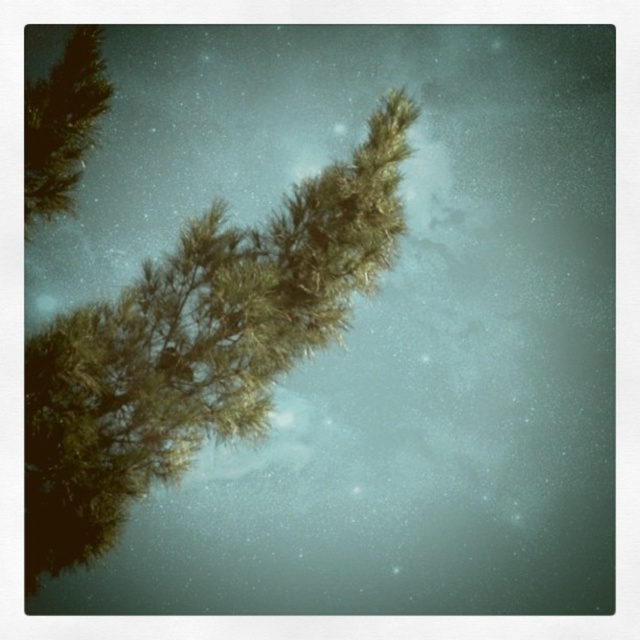
You are an artist painting a pine tree scene. You have two branches in your viewfinder, the green textured pine branch at upper left and the green matte tree branch at upper left. Which branch should you focus on if you want to depict the one that takes up more space in the composition?

The green matte tree branch at upper left takes up more space in the composition than the green textured pine branch at upper left, so you should focus on the green matte tree branch at upper left.

You are an astronomer observing the night sky through a telescope. You notice two green branches in your view, the green textured pine branch at upper left and the green matte tree branch at upper left. Which branch is closer to the telescope lens?

The green textured pine branch at upper left is closer to the telescope lens because it is positioned below the green matte tree branch at upper left, indicating it is in a lower plane relative to the observer.